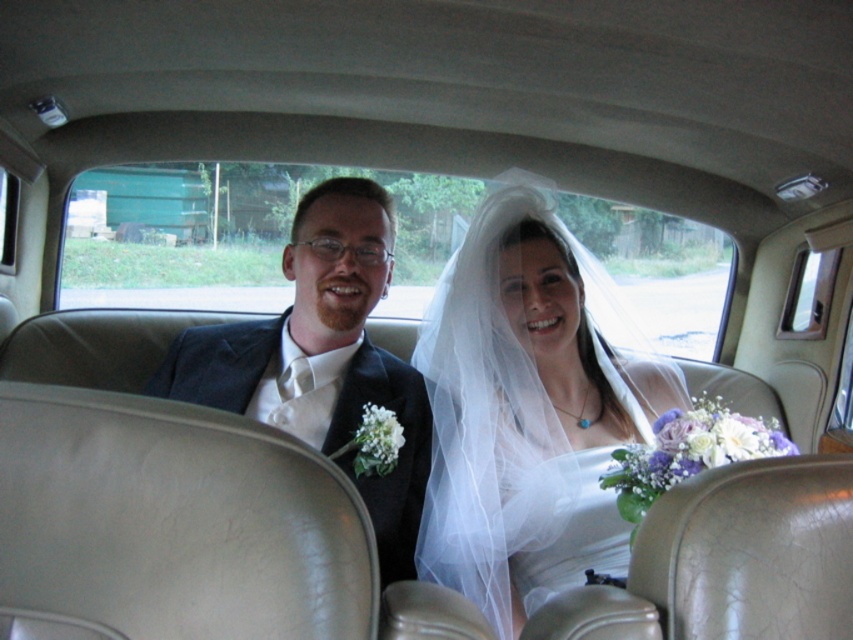
Can you confirm if white sheer veil at center is positioned above matte black suit at left?

Actually, white sheer veil at center is below matte black suit at left.

You are a GUI agent. You are given a task and a screenshot of the screen. Output one action in this format:
    pyautogui.click(x=<x>, y=<y>)
    Task: Click on the white sheer veil at center
    Image resolution: width=853 pixels, height=640 pixels.
    Given the screenshot: What is the action you would take?
    pyautogui.click(x=529, y=410)

I want to click on white sheer veil at center, so click(x=529, y=410).